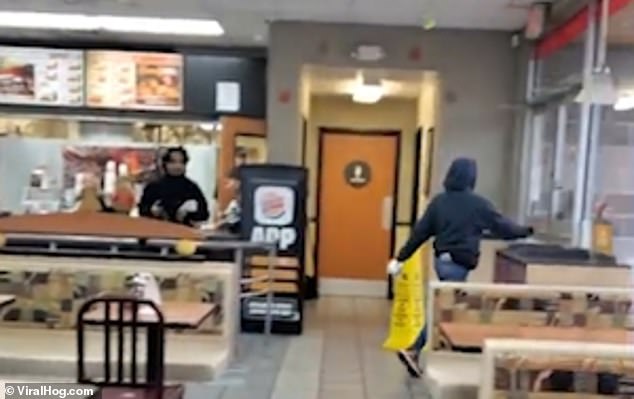
The height and width of the screenshot is (399, 634). Identify the location of door. (342, 191).